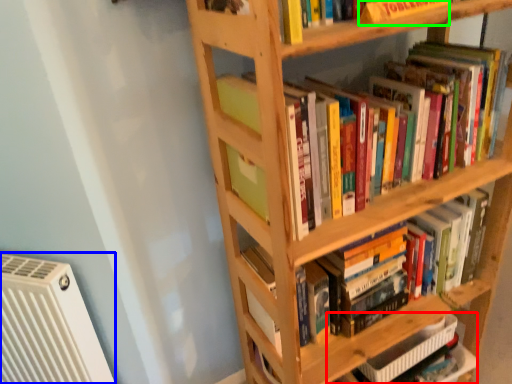
Question: Which is nearer to the book (highlighted by a red box)? air conditioning (highlighted by a blue box) or paperback book (highlighted by a green box).

Choices:
 (A) air conditioning
 (B) paperback book

Answer: (A)